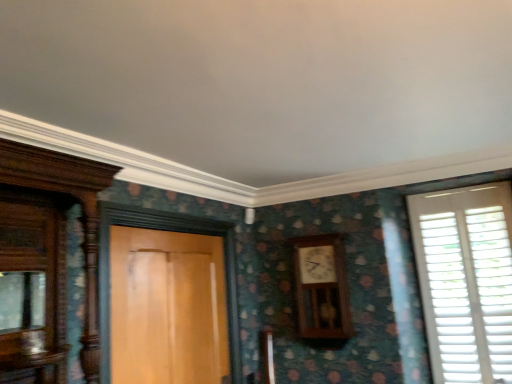
Question: Is wooden door at center wider than white wooden shutters at right?

Choices:
 (A) yes
 (B) no

Answer: (A)

Question: From a real-world perspective, is wooden door at center over white wooden shutters at right?

Choices:
 (A) yes
 (B) no

Answer: (B)

Question: From the image's perspective, is wooden door at center over white wooden shutters at right?

Choices:
 (A) no
 (B) yes

Answer: (A)

Question: Does wooden door at center have a smaller size compared to white wooden shutters at right?

Choices:
 (A) yes
 (B) no

Answer: (B)

Question: Is wooden door at center oriented away from white wooden shutters at right?

Choices:
 (A) no
 (B) yes

Answer: (A)

Question: Considering the positions of wooden door at center and wooden clock at center-right in the image, is wooden door at center bigger or smaller than wooden clock at center-right?

Choices:
 (A) big
 (B) small

Answer: (A)

Question: Based on their positions, is wooden door at center located to the left or right of wooden clock at center-right?

Choices:
 (A) right
 (B) left

Answer: (B)

Question: From the image's perspective, is wooden door at center above or below wooden clock at center-right?

Choices:
 (A) below
 (B) above

Answer: (A)

Question: Is wooden door at center wider or thinner than wooden clock at center-right?

Choices:
 (A) wide
 (B) thin

Answer: (B)

Question: In the image, is white wooden shutters at right on the left side or the right side of wooden door at center?

Choices:
 (A) left
 (B) right

Answer: (B)

Question: Is white wooden shutters at right wider or thinner than wooden door at center?

Choices:
 (A) thin
 (B) wide

Answer: (A)

Question: Is white wooden shutters at right inside the boundaries of wooden door at center, or outside?

Choices:
 (A) outside
 (B) inside

Answer: (A)

Question: From the image's perspective, is white wooden shutters at right positioned above or below wooden door at center?

Choices:
 (A) above
 (B) below

Answer: (A)

Question: Considering the positions of wooden clock at center-right and wooden door at center in the image, is wooden clock at center-right wider or thinner than wooden door at center?

Choices:
 (A) thin
 (B) wide

Answer: (B)

Question: Considering the positions of wooden clock at center-right and wooden door at center in the image, is wooden clock at center-right bigger or smaller than wooden door at center?

Choices:
 (A) big
 (B) small

Answer: (B)